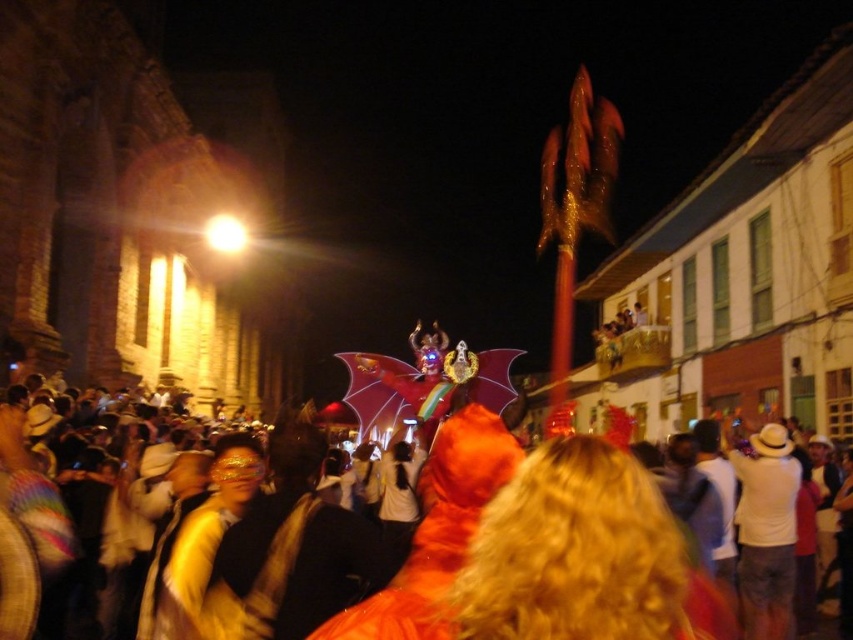
Looking at this image, is orange fur coat at center thinner than orange furry costume at center?

No.

Is orange fur coat at center positioned behind orange furry costume at center?

No.

The image size is (853, 640). Identify the location of orange fur coat at center. (425, 545).

At what (x,y) coordinates should I click in order to perform the action: click on orange fur coat at center. Please return your answer as a coordinate pair (x, y). Looking at the image, I should click on (425, 545).